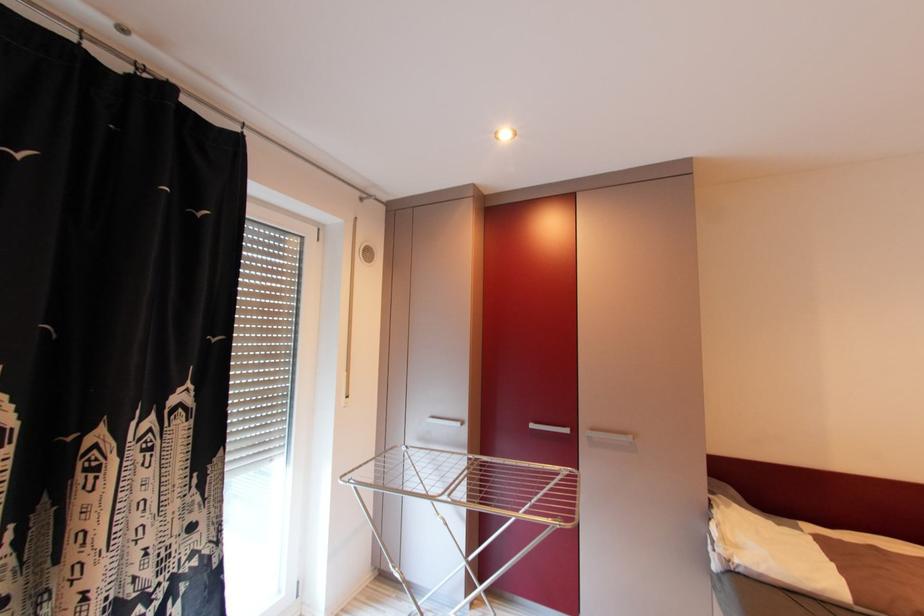
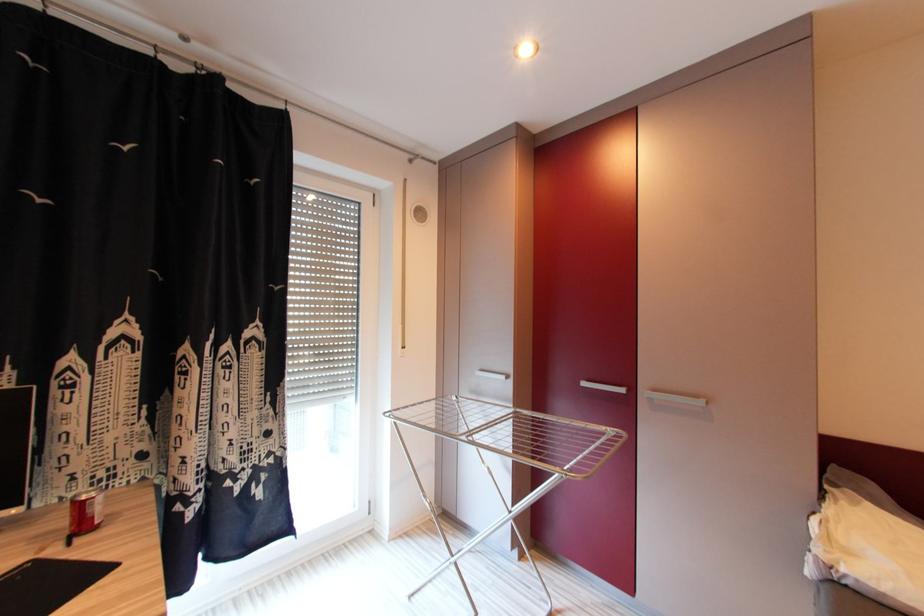
Question: Based on the continuous images, in which direction is the camera rotating? Reply with the corresponding letter.

Choices:
 (A) Left
 (B) Right
 (C) Up
 (D) Down

Answer: (A)